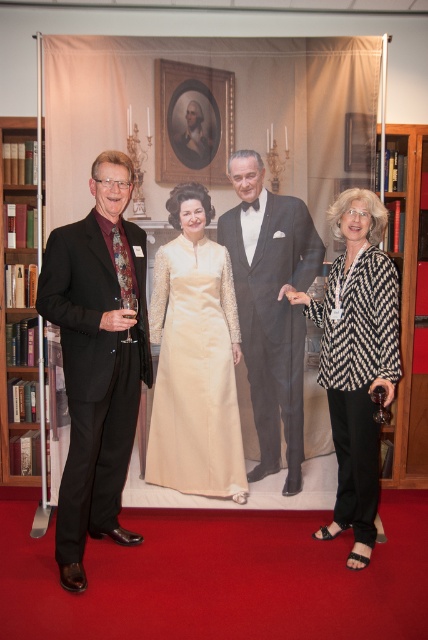
Between point (205, 316) and point (415, 243), which one is positioned behind?

Point (415, 243)

Is point (231, 396) positioned before point (421, 380)?

Yes, it is.

Is point (213, 460) positioned after point (425, 228)?

That is False.

This screenshot has width=428, height=640. In order to click on ivory satin gown at center in this screenshot , I will do `click(195, 358)`.

What do you see at coordinates (97, 358) in the screenshot? The height and width of the screenshot is (640, 428). I see `black satin suit at left` at bounding box center [97, 358].

In the scene shown: Does black satin suit at left lie behind ivory satin gown at center?

No.

Does point (50, 259) come in front of point (210, 209)?

Yes.

Locate an element on the screen. Image resolution: width=428 pixels, height=640 pixels. black satin suit at left is located at coordinates (97, 358).

Between matte black suit at left and brown wooden bookshelf at left, which one appears on the left side from the viewer's perspective?

brown wooden bookshelf at left is more to the left.

Between point (115, 412) and point (48, 484), which one is positioned behind?

The point (48, 484) is behind.

The image size is (428, 640). In order to click on matte black suit at left in this screenshot , I will do `click(95, 358)`.